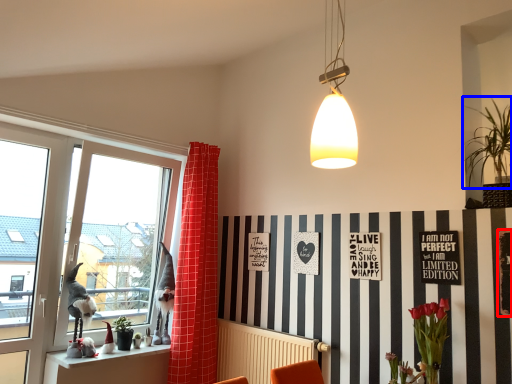
Question: Which object is closer to the camera taking this photo, bulletin board (highlighted by a red box) or plant (highlighted by a blue box)?

Choices:
 (A) bulletin board
 (B) plant

Answer: (A)